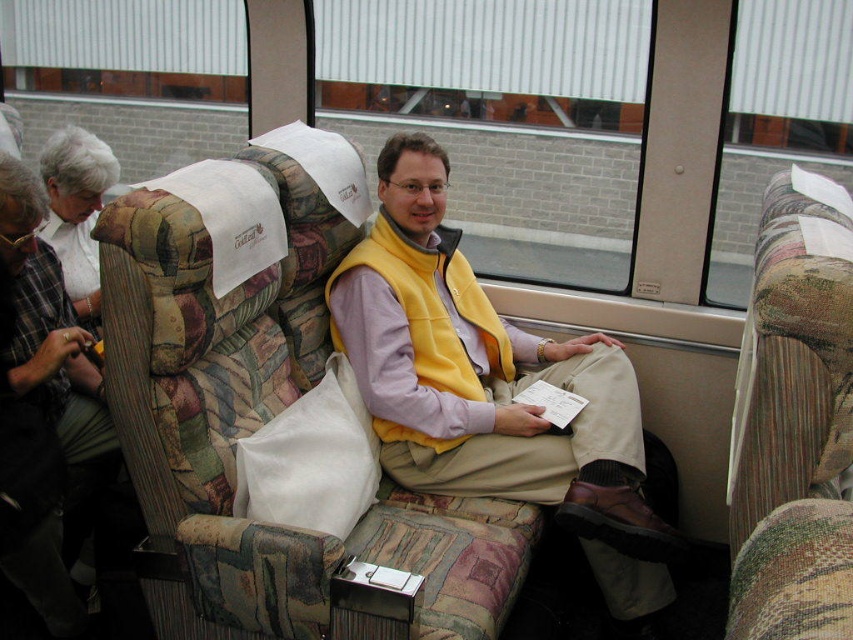
Question: From the image, what is the correct spatial relationship of patterned fabric armchair at center in relation to yellow fleece vest at center?

Choices:
 (A) below
 (B) above

Answer: (B)

Question: Can you confirm if yellow fleece vest at center is wider than camouflage fabric armchair at center?

Choices:
 (A) no
 (B) yes

Answer: (B)

Question: Considering the relative positions of patterned fabric armchair at center and camouflage fabric armchair at center in the image provided, where is patterned fabric armchair at center located with respect to camouflage fabric armchair at center?

Choices:
 (A) left
 (B) right

Answer: (A)

Question: Which point is closer to the camera taking this photo?

Choices:
 (A) (64, 168)
 (B) (807, 536)
 (C) (184, 172)

Answer: (B)

Question: Which object is the farthest from the yellow fleece vest at center?

Choices:
 (A) white fabric at upper left
 (B) plaid fabric coach at left
 (C) patterned fabric armchair at center
 (D) camouflage fabric armchair at center

Answer: (A)

Question: Which of the following is the farthest from the observer?

Choices:
 (A) (10, 276)
 (B) (183, 602)

Answer: (A)